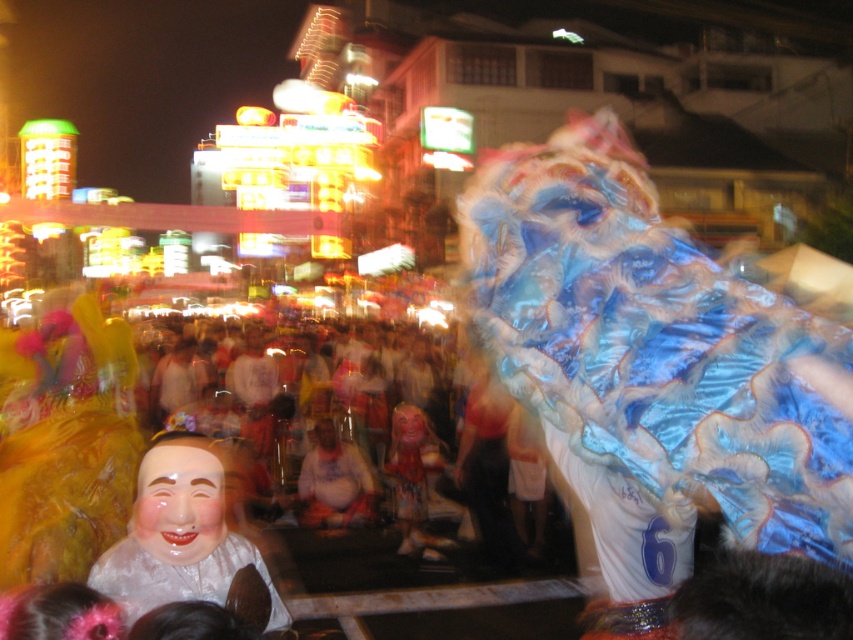
Question: Considering the relative positions of fat man in white shirt at center and shiny blue fabric dragon at center in the image provided, where is fat man in white shirt at center located with respect to shiny blue fabric dragon at center?

Choices:
 (A) right
 (B) left

Answer: (B)

Question: Which of the following is the farthest from the observer?

Choices:
 (A) (363, 490)
 (B) (138, 566)
 (C) (401, 483)

Answer: (A)

Question: Estimate the real-world distances between objects in this image. Which object is farther from the fat man in white shirt at center?

Choices:
 (A) shiny blue fabric dragon at center
 (B) smooth porcelain mask at center

Answer: (B)

Question: Is fat man in white shirt at center positioned in front of shiny blue fabric dragon at center?

Choices:
 (A) yes
 (B) no

Answer: (B)

Question: Is smooth porcelain mask at center thinner than shiny blue fabric dragon at center?

Choices:
 (A) no
 (B) yes

Answer: (A)

Question: Which point is closer to the camera?

Choices:
 (A) (405, 506)
 (B) (158, 456)
 (C) (306, 483)

Answer: (B)